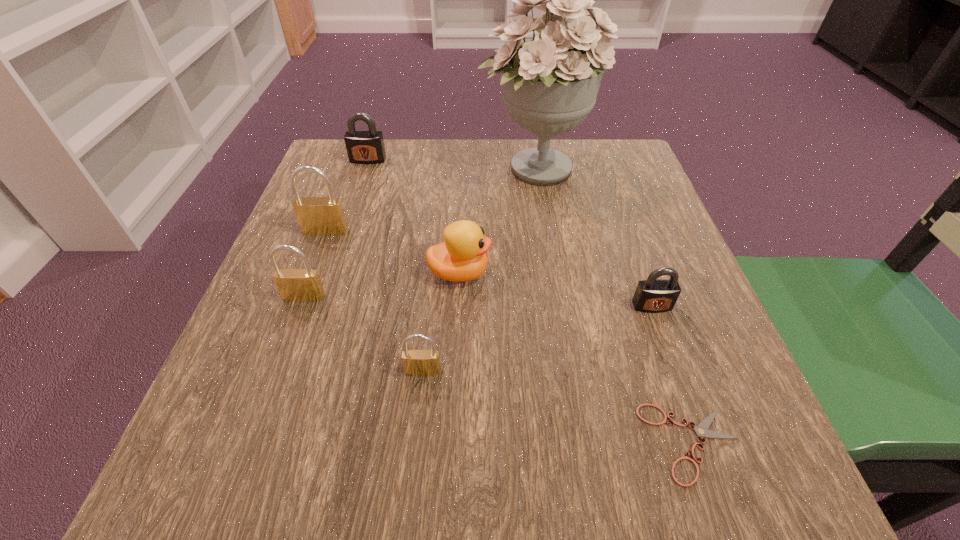
I want to click on vacant region that satisfies the following two spatial constraints: 1. on the front-facing side of the nearest object; 2. on the left side of the fourth padlock from left to right, so click(x=416, y=443).

The width and height of the screenshot is (960, 540). I want to click on free spot that satisfies the following two spatial constraints: 1. on the face of the duckling; 2. on the back side of the nearest object, so click(451, 443).